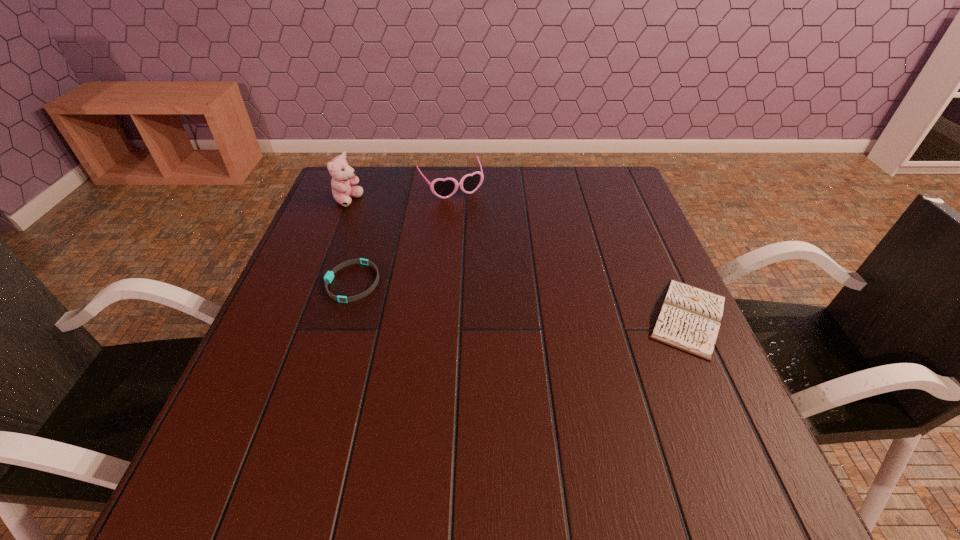
The image size is (960, 540). Find the location of `free space between the tallest object and the diary`. free space between the tallest object and the diary is located at coordinates (518, 259).

I want to click on free point between the diary and the teddy bear, so click(x=518, y=259).

What are the coordinates of `blank region between the teddy bear and the shortest object` in the screenshot? It's located at (349, 241).

Where is `free spot between the third object from left to right and the teddy bear`? Image resolution: width=960 pixels, height=540 pixels. free spot between the third object from left to right and the teddy bear is located at coordinates (399, 193).

Find the location of a particular element. free space between the wristband and the tallest object is located at coordinates (349, 241).

Find the location of a particular element. object that is the nearest to the third tallest object is located at coordinates (443, 188).

Select which object is the second closest to the wristband. Please provide its 2D coordinates. Your answer should be formatted as a tuple, i.e. [(x, y)], where the tuple contains the x and y coordinates of a point satisfying the conditions above.

[(443, 188)]

Locate an element on the screen. The height and width of the screenshot is (540, 960). vacant space that satisfies the following two spatial constraints: 1. on the front side of the tallest object; 2. on the buckle of the shortest object is located at coordinates (316, 282).

The width and height of the screenshot is (960, 540). I want to click on vacant space that satisfies the following two spatial constraints: 1. on the back side of the third object from left to right; 2. on the right side of the tallest object, so pos(354,186).

Locate an element on the screen. The height and width of the screenshot is (540, 960). vacant region that satisfies the following two spatial constraints: 1. on the front side of the sunglasses; 2. on the left side of the rightmost object is located at coordinates (438, 317).